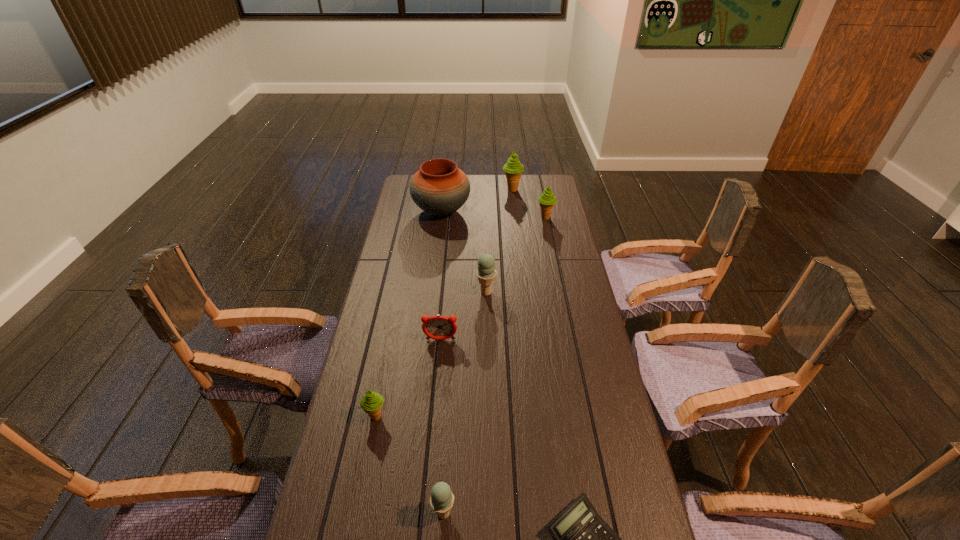
This screenshot has height=540, width=960. What are the coordinates of `the nearest ice cream` in the screenshot? It's located at (442, 499).

You are a GUI agent. You are given a task and a screenshot of the screen. Output one action in this format:
    pyautogui.click(x=<x>, y=<y>)
    Task: Click on the reddish-pink alarm clock
    The image size is (960, 540).
    Given the screenshot: What is the action you would take?
    pyautogui.click(x=437, y=327)

Identify the location of the fifth farthest object. (437, 327).

I want to click on vacant region located on the right of the pottery, so click(521, 211).

At what (x,y) coordinates should I click in order to perform the action: click on vacant space located on the left of the biggest green icecream. Please return your answer as a coordinate pair (x, y). Looking at the image, I should click on (455, 190).

Locate an element on the screen. vacant space situated on the front of the rightmost ice cream is located at coordinates (551, 246).

What are the coordinates of `blank area located on the back of the third nearest ice cream` in the screenshot? It's located at (485, 226).

Where is `vacant space located on the back of the second nearest ice cream`? The image size is (960, 540). vacant space located on the back of the second nearest ice cream is located at coordinates (386, 367).

At what (x,y) coordinates should I click in order to perform the action: click on blank area located 0.190m on the right of the nearest ice cream. Please return your answer as a coordinate pair (x, y). Looking at the image, I should click on (537, 513).

I want to click on free location located 0.360m on the front-facing side of the reddish-pink alarm clock, so click(x=431, y=449).